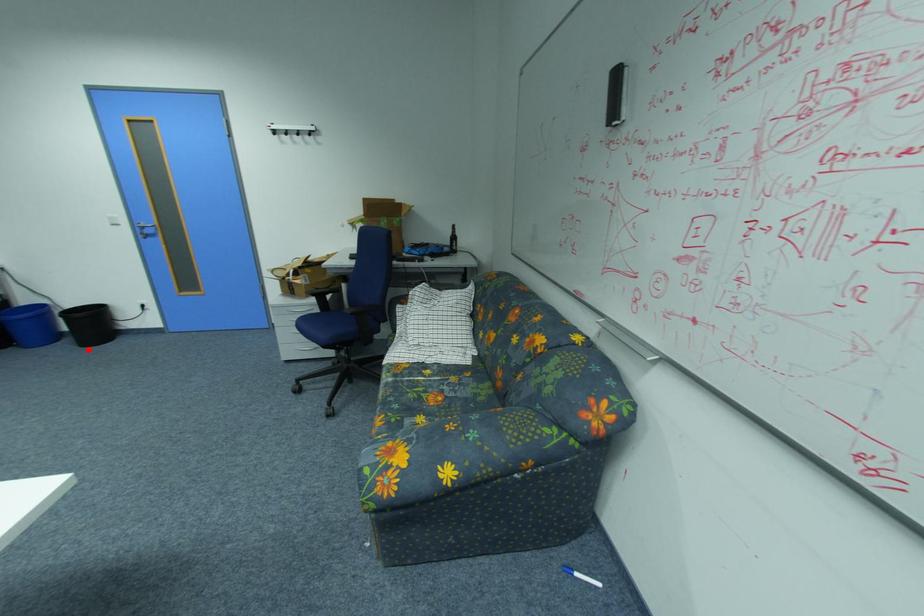
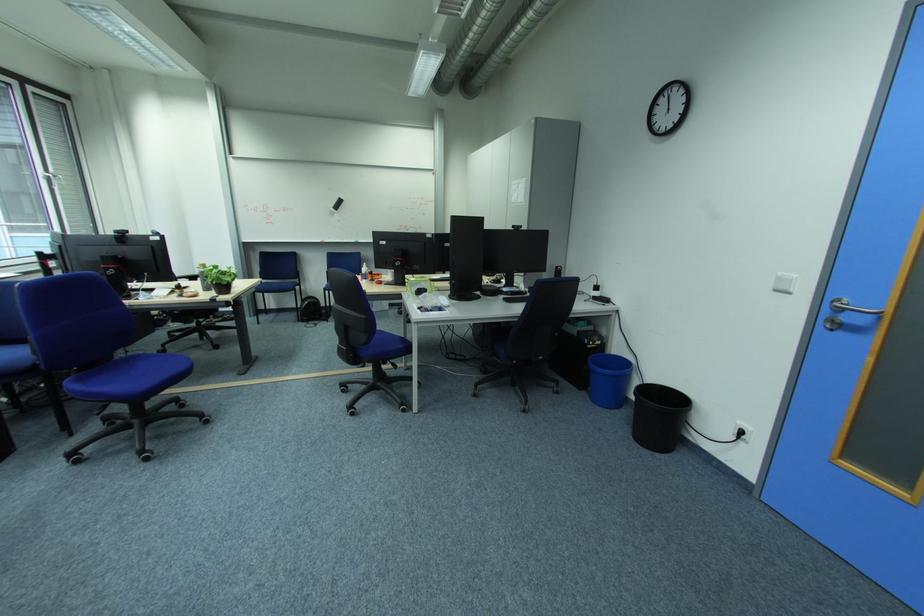
Find the pixel in the second image that matches the highlighted location in the first image.

(640, 439)